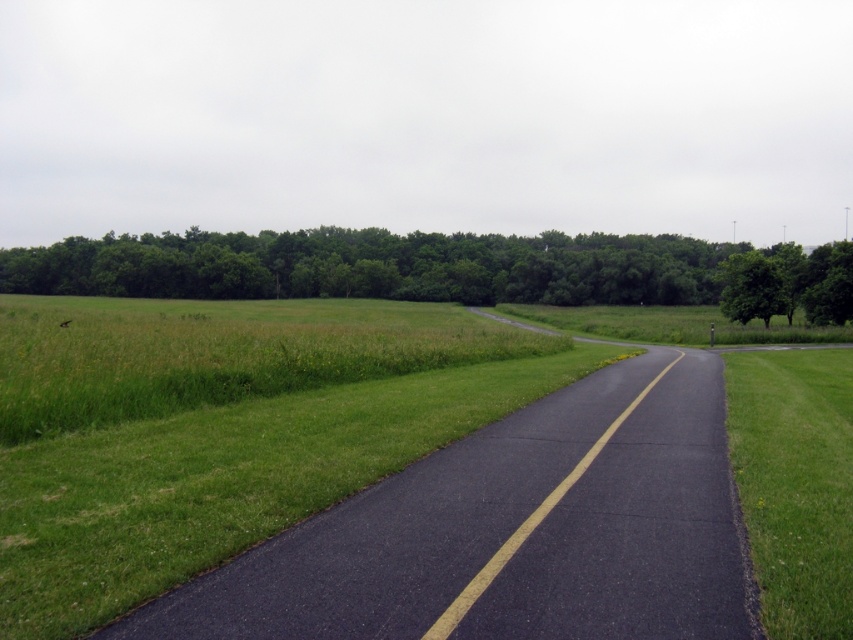
You are a gardener planning to mow the green grass at center and the green leafy tree at right. Which area should you mow first if you want to start from the area closer to the dense line of trees in the background?

The green grass at center should be mowed first because it is positioned under the green leafy tree at right, meaning it is closer to the dense line of trees in the background.

You are a gardener planning to mow the green grass at right. There is a green leafy tree at center nearby. Which direction should you avoid mowing to prevent damaging the tree?

The green leafy tree at center is positioned on the right side of green grass at right, so you should avoid mowing towards the right side of the green grass at right to prevent damaging the tree.

You are standing at the origin point of the image. You want to walk to the green grass at center. Which direction should you move in to reach it?

The green grass at center is located at point 0.670 on the x axis and 0.259 on the y axis, so you should move towards the right and slightly upwards to reach it.